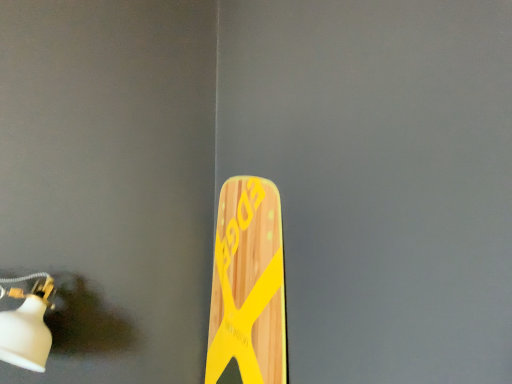
Describe the element at coordinates (27, 324) in the screenshot. I see `white matte light fixture at lower left` at that location.

In order to face white matte light fixture at lower left, should I rotate leftwards or rightwards?

To align with it, rotate left about 27.866°.

Identify the location of white matte light fixture at lower left. (27, 324).

Measure the distance between point [12,345] and camera.

Point [12,345] is 29.45 inches from camera.

The height and width of the screenshot is (384, 512). Identify the location of white matte light fixture at lower left. (27, 324).